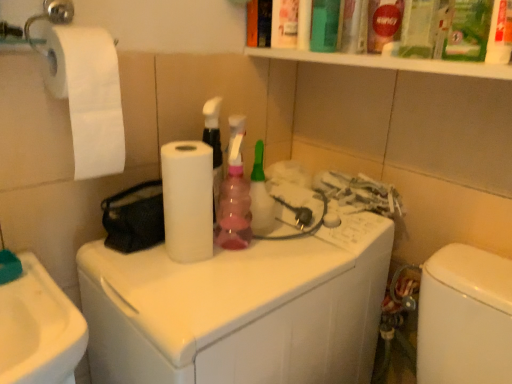
Question: In terms of width, does pink plastic spray bottle at center look wider or thinner when compared to white matte paper towel at center?

Choices:
 (A) thin
 (B) wide

Answer: (A)

Question: Is point (221, 233) closer or farther from the camera than point (170, 150)?

Choices:
 (A) farther
 (B) closer

Answer: (A)

Question: Which is nearer to the white glossy washing machine at center?

Choices:
 (A) pink plastic spray bottle at center
 (B) white matte toilet paper at left
 (C) white matte paper towel at center

Answer: (C)

Question: Which of these objects is positioned closest to the pink plastic spray bottle at center?

Choices:
 (A) white glossy washing machine at center
 (B) white matte paper towel at center
 (C) white matte toilet paper at left

Answer: (B)